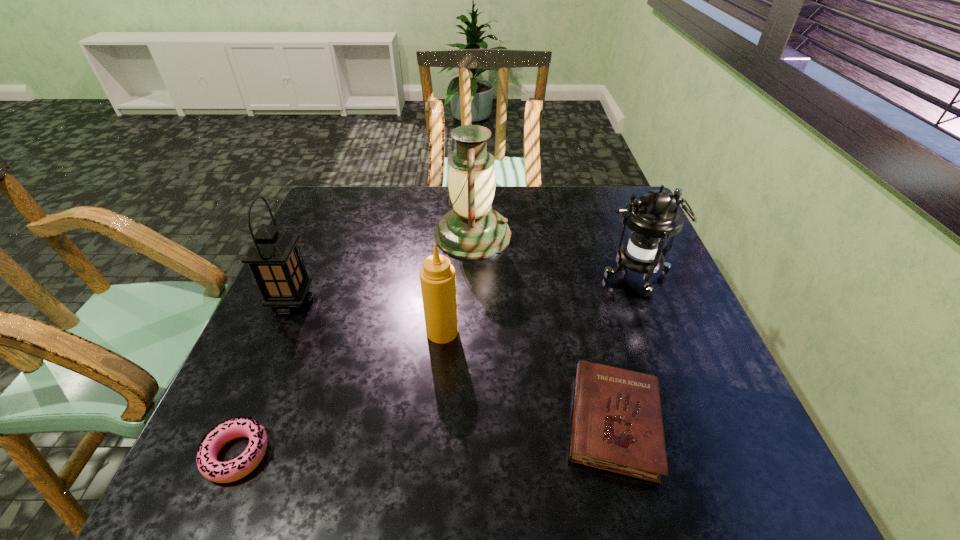
Where is `blank space located on the left of the hardback book`? The width and height of the screenshot is (960, 540). blank space located on the left of the hardback book is located at coordinates (371, 423).

Image resolution: width=960 pixels, height=540 pixels. I want to click on free region located 0.390m on the right of the doughnut, so click(481, 455).

Identify the location of object located in the far edge section of the desktop. (472, 229).

Image resolution: width=960 pixels, height=540 pixels. What are the coordinates of `hardback book that is at the near edge` in the screenshot? It's located at (617, 426).

Identify the location of doughnut that is at the near edge. (221, 472).

Locate an element on the screen. Image resolution: width=960 pixels, height=540 pixels. lantern present at the left edge is located at coordinates (274, 258).

Identify the location of doughnut that is at the left edge. (221, 472).

I want to click on lantern located at the right edge, so click(x=652, y=218).

Find the location of a particular element. This screenshot has height=540, width=960. hardback book at the right edge is located at coordinates (617, 426).

Where is `object located at the near left corner`? object located at the near left corner is located at coordinates (221, 472).